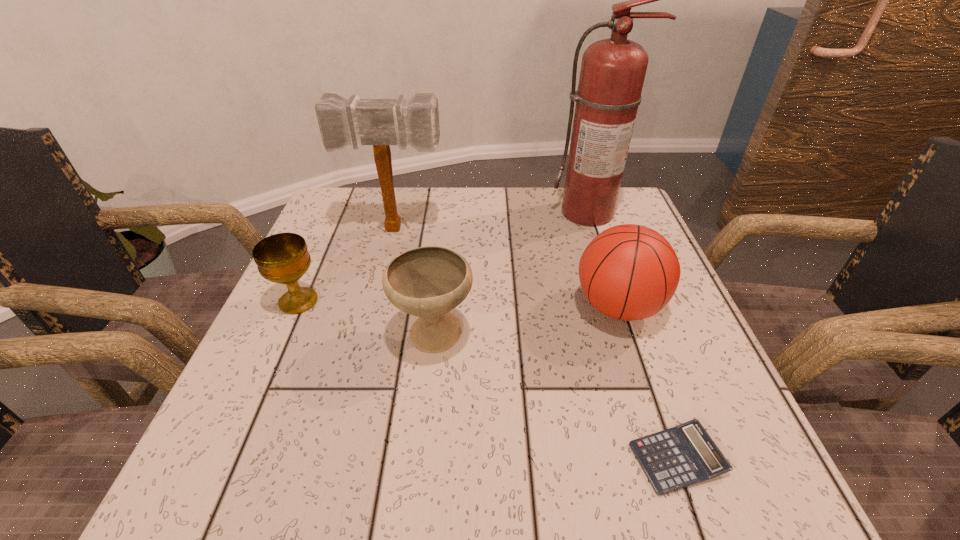
The image size is (960, 540). Find the location of `basketball located at the right edge`. basketball located at the right edge is located at coordinates (628, 272).

Find the location of a particular element. The width and height of the screenshot is (960, 540). calculator that is at the right edge is located at coordinates (684, 455).

I want to click on object that is at the far left corner, so click(379, 122).

The width and height of the screenshot is (960, 540). Identify the location of object at the far right corner. (612, 74).

Find the location of a particular element. The height and width of the screenshot is (540, 960). object that is at the near right corner is located at coordinates (684, 455).

Locate an element on the screen. free space at the far edge of the desktop is located at coordinates coord(527,207).

This screenshot has height=540, width=960. I want to click on vacant space at the near edge of the desktop, so click(585, 481).

The height and width of the screenshot is (540, 960). I want to click on vacant point at the left edge, so click(x=310, y=278).

The image size is (960, 540). I want to click on free region at the right edge of the desktop, so click(681, 292).

The image size is (960, 540). Identify the location of vacant space at the far left corner of the desktop. (326, 225).